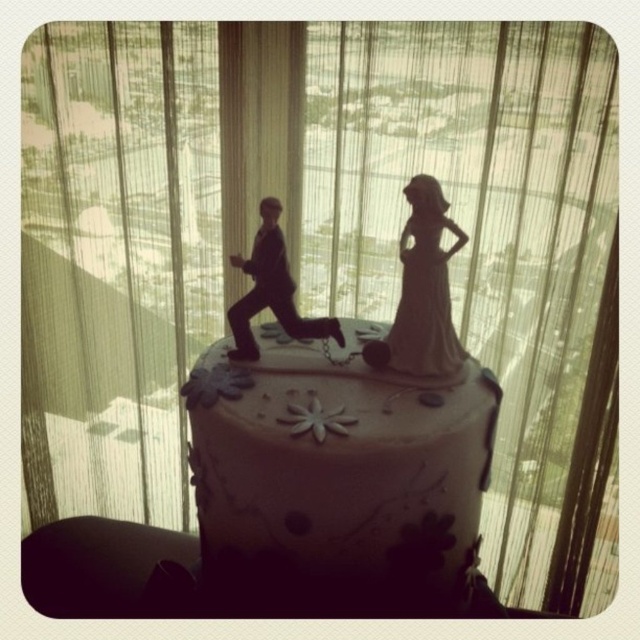
You are a guest at the wedding reception and want to take a photo of the white matte cake at center and the matte black figure at center. Which object should you focus on first if you want to capture both in the same frame without moving the camera?

You should focus on the white matte cake at center first because it is taller than the matte black figure at center, so it will be easier to ensure both are in frame by starting with the taller object.

You are a guest at the wedding reception and want to take a photo of the cake. The photographer tells you that the white porcelain bride at center and the matte black figure at center are in different positions. Which figurine will appear larger in the photo?

The white porcelain bride at center will appear larger in the photo because it is closer to the viewer than the matte black figure at center.